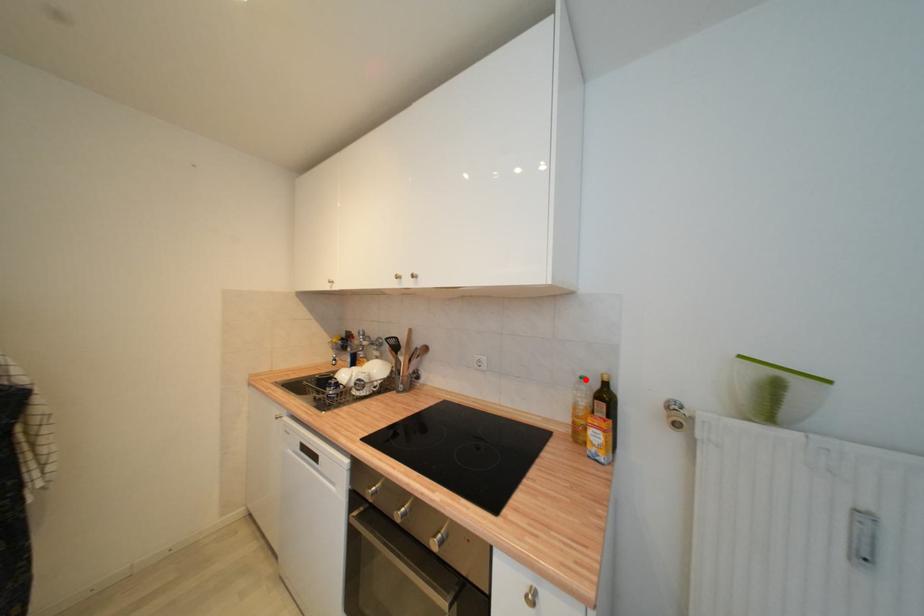
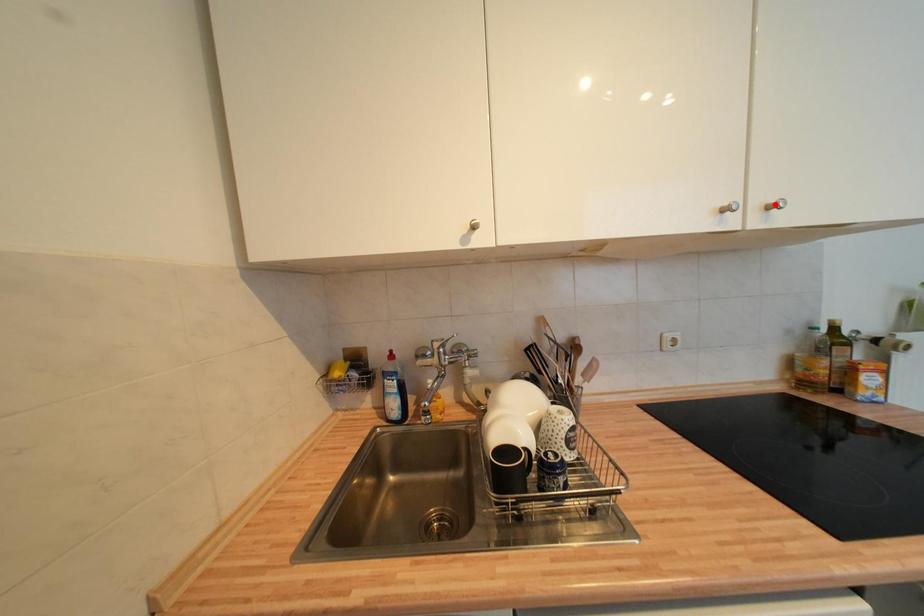
I am providing you with two images of the same scene from different viewpoints. A red point is marked on the first image and another point is marked on the second image. Is the marked point in image1 the same physical position as the marked point in image2?

No